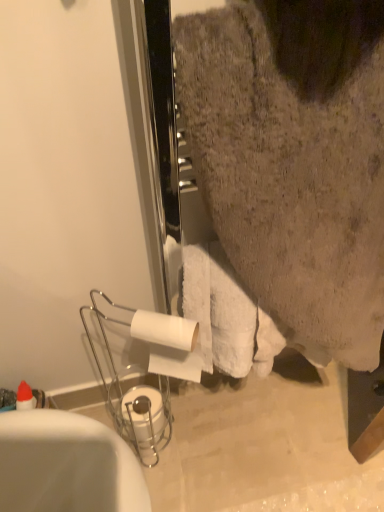
Question: Can you confirm if white matte toilet paper at lower center, arranged as the 1th toilet paper when ordered from the bottom, is shorter than white glossy bathtub at lower left?

Choices:
 (A) yes
 (B) no

Answer: (A)

Question: Does white matte toilet paper at lower center, marked as the first toilet paper in a back-to-front arrangement, lie in front of white glossy bathtub at lower left?

Choices:
 (A) yes
 (B) no

Answer: (B)

Question: Is white matte toilet paper at lower center, arranged as the 1th toilet paper when ordered from the bottom, further to the viewer compared to white glossy bathtub at lower left?

Choices:
 (A) no
 (B) yes

Answer: (B)

Question: Does white matte toilet paper at lower center, arranged as the 1th toilet paper when ordered from the bottom, have a smaller size compared to white glossy bathtub at lower left?

Choices:
 (A) no
 (B) yes

Answer: (B)

Question: Considering the relative sizes of white matte toilet paper at lower center, arranged as the 1th toilet paper when ordered from the bottom, and white glossy bathtub at lower left in the image provided, is white matte toilet paper at lower center, arranged as the 1th toilet paper when ordered from the bottom, taller than white glossy bathtub at lower left?

Choices:
 (A) no
 (B) yes

Answer: (A)

Question: In terms of width, does white matte toilet paper at center, which ranks as the 1th toilet paper in top-to-bottom order, look wider or thinner when compared to white fluffy towel at upper right?

Choices:
 (A) thin
 (B) wide

Answer: (A)

Question: Based on their positions, is white matte toilet paper at center, which is counted as the 2th toilet paper, starting from the back, located to the left or right of white fluffy towel at upper right?

Choices:
 (A) right
 (B) left

Answer: (B)

Question: Relative to white fluffy towel at upper right, is white matte toilet paper at center, the first toilet paper when ordered from front to back, in front or behind?

Choices:
 (A) behind
 (B) front

Answer: (A)

Question: Considering the positions of point (185, 335) and point (271, 241), is point (185, 335) closer or farther from the camera than point (271, 241)?

Choices:
 (A) farther
 (B) closer

Answer: (A)

Question: Is point (94, 423) positioned closer to the camera than point (183, 364)?

Choices:
 (A) closer
 (B) farther

Answer: (A)

Question: In the image, is white glossy bathtub at lower left on the left side or the right side of white matte toilet paper at center, which is counted as the second toilet paper, starting from the bottom?

Choices:
 (A) left
 (B) right

Answer: (A)

Question: Which is correct: white glossy bathtub at lower left is inside white matte toilet paper at center, which is counted as the 2th toilet paper, starting from the back, or outside of it?

Choices:
 (A) inside
 (B) outside

Answer: (B)

Question: From the image's perspective, is white glossy bathtub at lower left located above or below white matte toilet paper at center, which ranks as the 1th toilet paper in top-to-bottom order?

Choices:
 (A) above
 (B) below

Answer: (B)

Question: Considering the positions of white matte toilet paper at lower center, marked as the first toilet paper in a back-to-front arrangement, and white fluffy towel at upper right in the image, is white matte toilet paper at lower center, marked as the first toilet paper in a back-to-front arrangement, wider or thinner than white fluffy towel at upper right?

Choices:
 (A) thin
 (B) wide

Answer: (A)

Question: Is point (150, 411) closer or farther from the camera than point (382, 203)?

Choices:
 (A) farther
 (B) closer

Answer: (A)